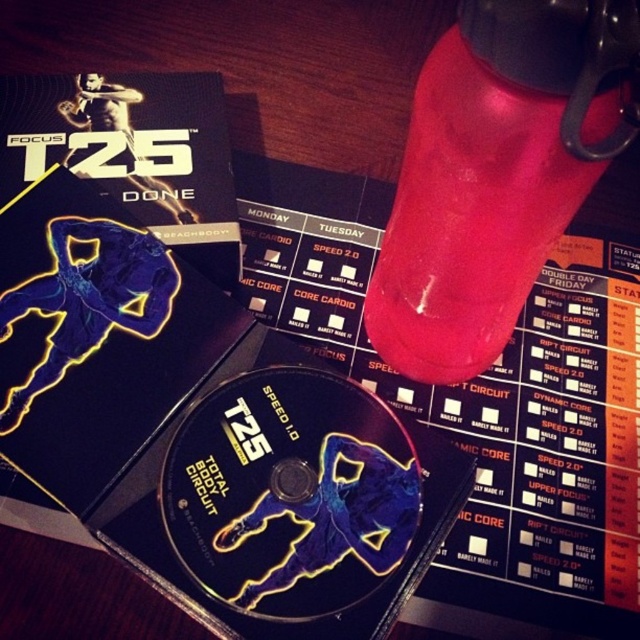
Question: Is red matte water bottle at upper right positioned behind shiny black cd at center?

Choices:
 (A) no
 (B) yes

Answer: (A)

Question: Which of the following is the closest to the observer?

Choices:
 (A) red matte water bottle at upper right
 (B) shiny black cd at center

Answer: (A)

Question: Where is red matte water bottle at upper right located in relation to shiny black cd at center in the image?

Choices:
 (A) above
 (B) below

Answer: (A)

Question: Which of the following is the farthest from the observer?

Choices:
 (A) (422, 284)
 (B) (179, 492)

Answer: (A)

Question: Observing the image, what is the correct spatial positioning of red matte water bottle at upper right in reference to shiny black cd at center?

Choices:
 (A) below
 (B) above

Answer: (B)